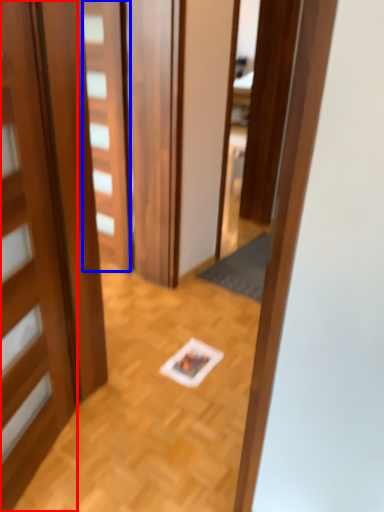
Question: Which of the following is the farthest to the observer, door (highlighted by a red box) or door (highlighted by a blue box)?

Choices:
 (A) door
 (B) door

Answer: (B)